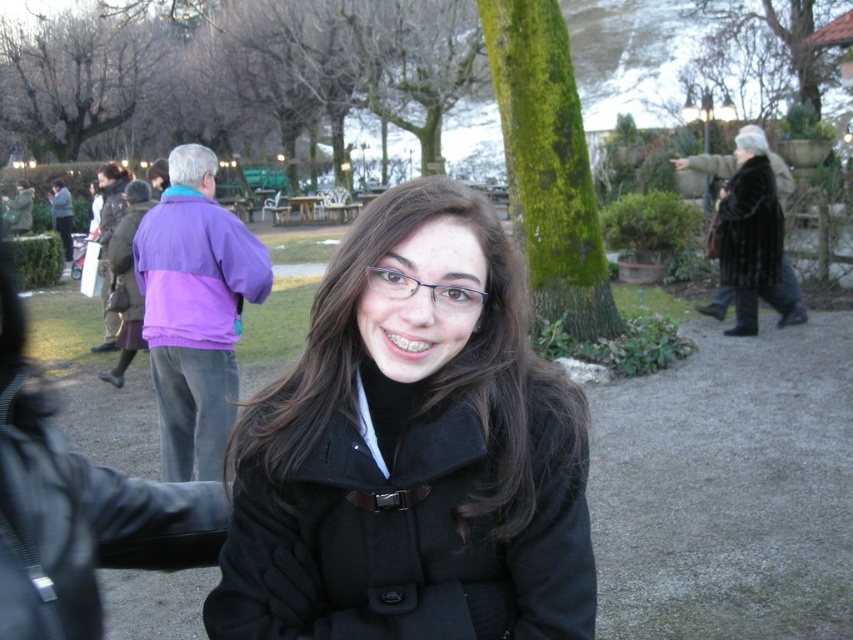
You are standing at the point labeled point [173,456] and want to walk towards the point labeled point [672,157] in the scene. Considering the spatial relationship between these two points, will you be moving towards the background or the foreground of the image?

Since point [173,456] is closer to the camera than point [672,157], moving from point [173,456] towards point [672,157] would mean you are moving towards the background of the image.

You are a photographer trying to capture a clear shot of the black wool coat at center and the purple fleece jacket at upper left. Which object is closer to the camera?

The black wool coat at center is positioned under the purple fleece jacket at upper left, meaning the purple fleece jacket at upper left is closer to the camera.